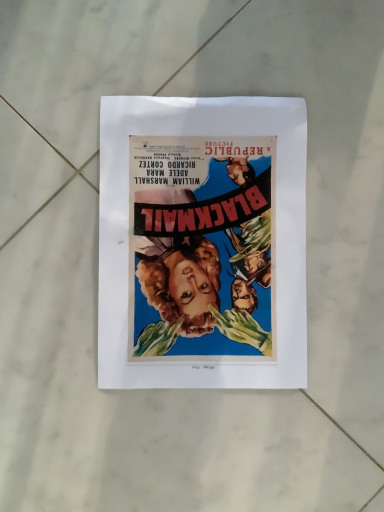
Where is `vibrant paper poster at center`? vibrant paper poster at center is located at coordinates (202, 243).

This screenshot has height=512, width=384. What do you see at coordinates (202, 243) in the screenshot?
I see `vibrant paper poster at center` at bounding box center [202, 243].

Find the location of a particular element. This screenshot has height=512, width=384. vibrant paper poster at center is located at coordinates click(202, 243).